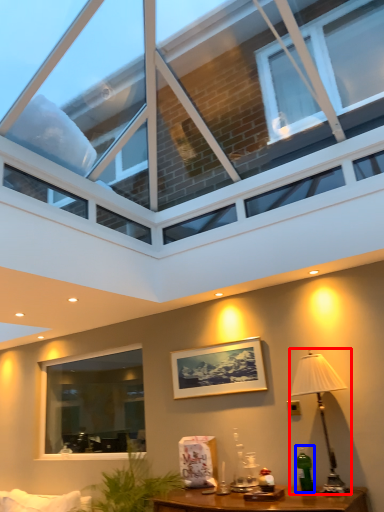
Question: Which object is further to the camera taking this photo, table lamp (highlighted by a red box) or bottle (highlighted by a blue box)?

Choices:
 (A) table lamp
 (B) bottle

Answer: (B)